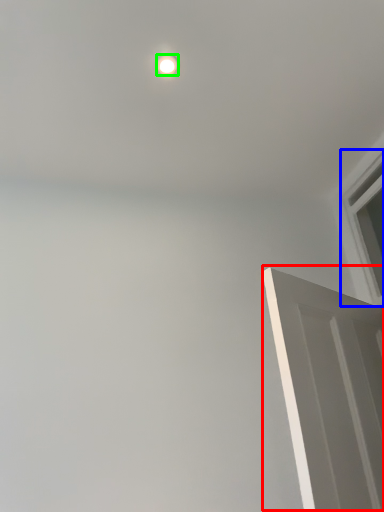
Question: Which is farther away from door (highlighted by a red box)? window (highlighted by a blue box) or lighting (highlighted by a green box)?

Choices:
 (A) window
 (B) lighting

Answer: (B)